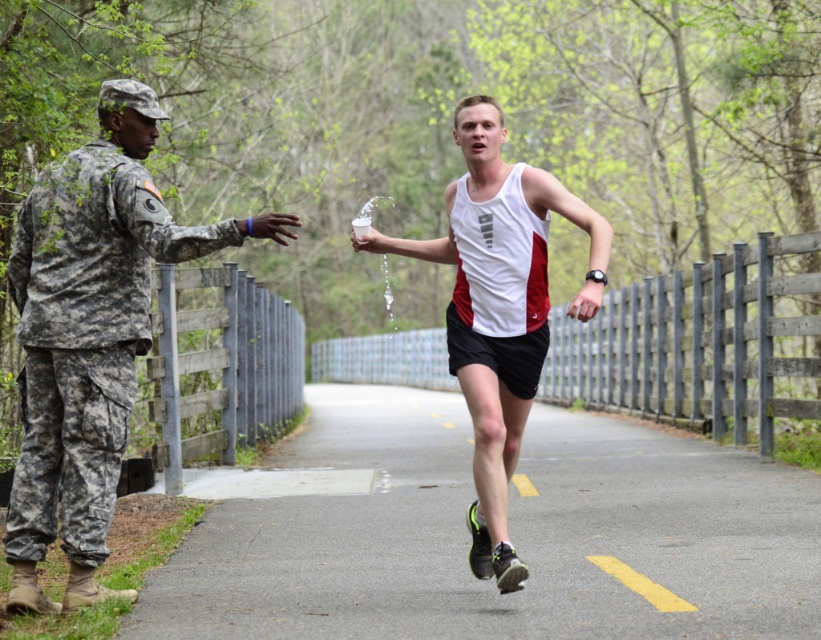
Question: Is camouflage uniform at left bigger than white matte tank top at center?

Choices:
 (A) no
 (B) yes

Answer: (A)

Question: Which point is farther to the camera?

Choices:
 (A) (120, 156)
 (B) (508, 451)

Answer: (B)

Question: Considering the relative positions of black rubber shoe at center and white matte tank top at center in the image provided, where is black rubber shoe at center located with respect to white matte tank top at center?

Choices:
 (A) right
 (B) left

Answer: (A)

Question: Can you confirm if camouflage uniform at left is positioned to the left of white matte tank top at center?

Choices:
 (A) yes
 (B) no

Answer: (A)

Question: Which of the following is the farthest from the observer?

Choices:
 (A) (498, 556)
 (B) (164, 209)
 (C) (789, 556)

Answer: (C)

Question: Which point appears farthest from the camera in this image?

Choices:
 (A) (783, 602)
 (B) (118, 376)
 (C) (507, 564)

Answer: (B)